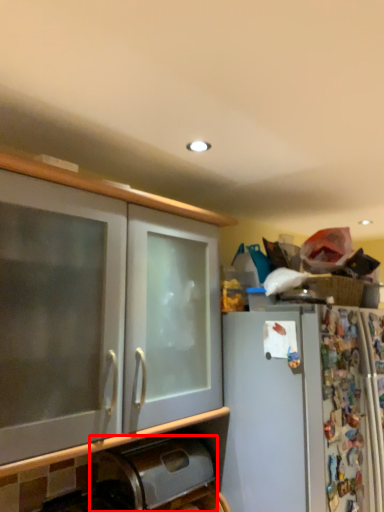
Question: From the image's perspective, considering the relative positions of appliance (annotated by the red box) and cabinetry in the image provided, where is appliance (annotated by the red box) located with respect to the staircase?

Choices:
 (A) above
 (B) below

Answer: (B)